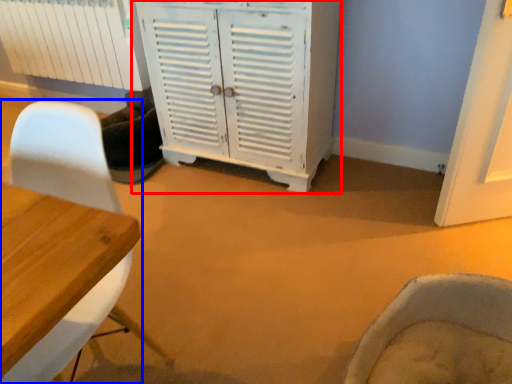
Question: Which of the following is the farthest to the observer, cabinetry (highlighted by a red box) or chair (highlighted by a blue box)?

Choices:
 (A) cabinetry
 (B) chair

Answer: (A)